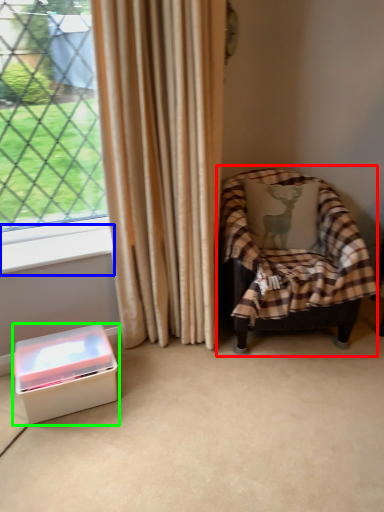
Question: Estimate the real-world distances between objects in this image. Which object is farther from chair (highlighted by a red box), window sill (highlighted by a blue box) or box (highlighted by a green box)?

Choices:
 (A) window sill
 (B) box

Answer: (B)